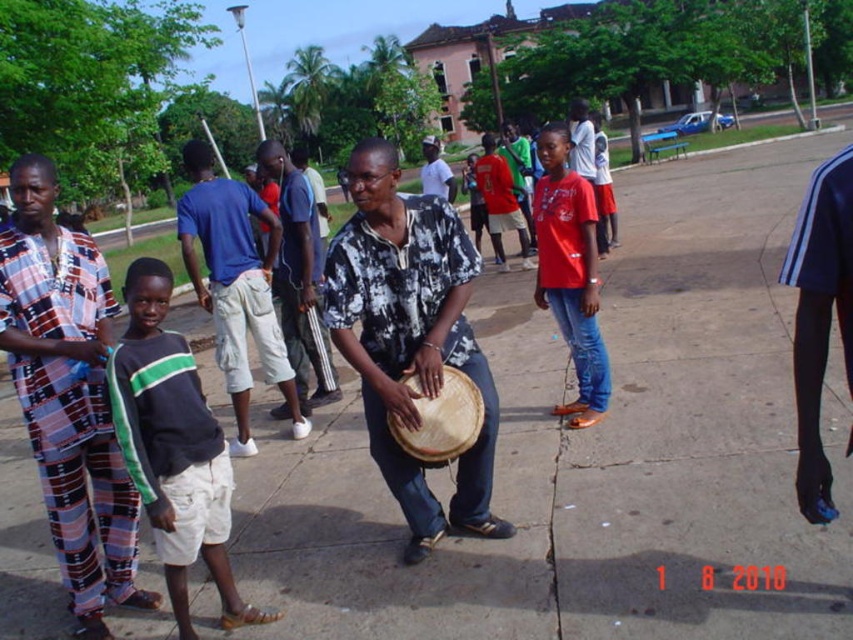
You are a photographer trying to capture both the plaid fabric shirt at left and the matte black shirt at center in the same frame. Which shirt should you focus on first to ensure they both fit in the shot?

The plaid fabric shirt at left is larger in size than the matte black shirt at center, so you should focus on the plaid fabric shirt at left first to ensure both fit in the shot.

What is the color of the shirt worn by the person at the coordinates point (173, 448)?

The dark gray green striped shirt at left is the color of the shirt worn by the person at point (173, 448).